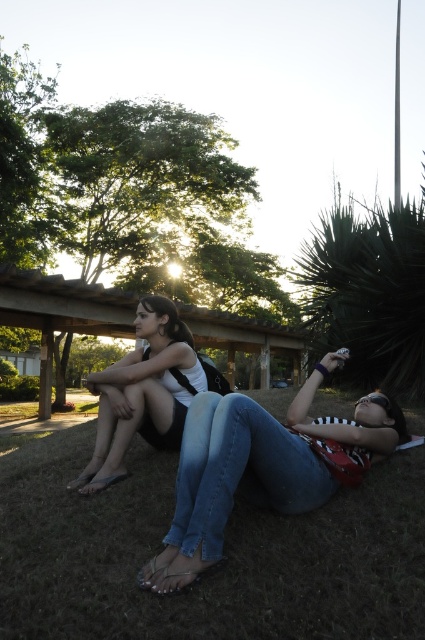
Does green grass at lower center appear over matte white tank top at center?

Actually, green grass at lower center is below matte white tank top at center.

Is point (48, 524) farther from camera compared to point (142, 298)?

No, (48, 524) is in front of (142, 298).

I want to click on green grass at lower center, so click(x=223, y=552).

Who is more distant from viewer, (334, 472) or (133, 429)?

The point (133, 429) is behind.

From the picture: Can you confirm if denim jeans at lower center is wider than matte white tank top at center?

Indeed, denim jeans at lower center has a greater width compared to matte white tank top at center.

Is point (197, 509) closer to viewer compared to point (161, 410)?

Yes.

At what (x,y) coordinates should I click in order to perform the action: click on denim jeans at lower center. Please return your answer as a coordinate pair (x, y). The height and width of the screenshot is (640, 425). Looking at the image, I should click on (261, 465).

Between green grass at lower center and denim jeans at lower center, which one appears on the right side from the viewer's perspective?

From the viewer's perspective, denim jeans at lower center appears more on the right side.

Is green grass at lower center above denim jeans at lower center?

Incorrect, green grass at lower center is not positioned above denim jeans at lower center.

What do you see at coordinates (223, 552) in the screenshot?
I see `green grass at lower center` at bounding box center [223, 552].

Identify the location of green grass at lower center. This screenshot has height=640, width=425. (223, 552).